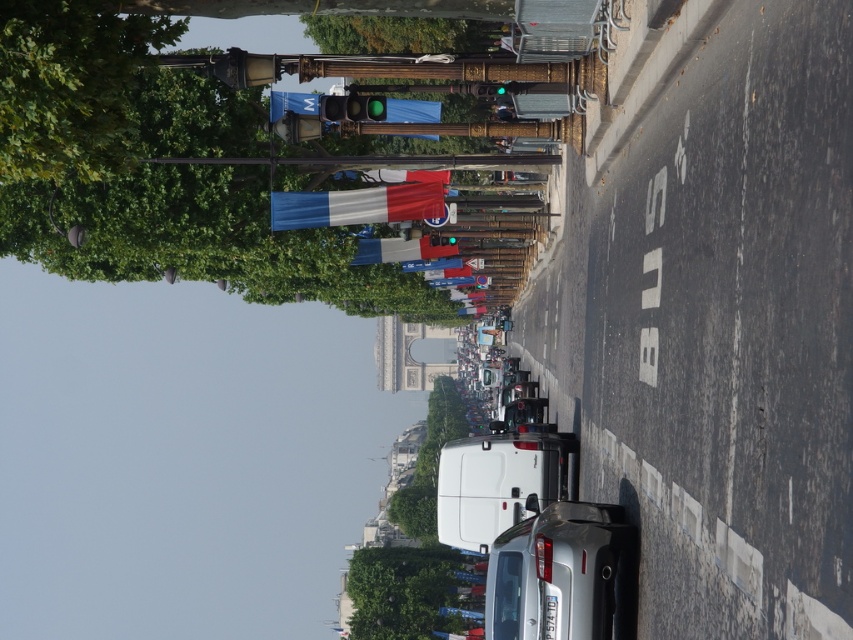
Between tricolor fabric flag at center and green leafy tree at upper center, which one has more height?

With more height is green leafy tree at upper center.

Can you confirm if tricolor fabric flag at center is bigger than green leafy tree at upper center?

Actually, tricolor fabric flag at center might be smaller than green leafy tree at upper center.

This screenshot has width=853, height=640. Describe the element at coordinates (361, 204) in the screenshot. I see `tricolor fabric flag at center` at that location.

Locate an element on the screen. The width and height of the screenshot is (853, 640). tricolor fabric flag at center is located at coordinates (361, 204).

At what (x,y) coordinates should I click in order to perform the action: click on green leafy tree at upper left. Please return your answer as a coordinate pair (x, y). Looking at the image, I should click on [68, 83].

Does green leafy tree at upper left have a larger size compared to tricolor fabric flag at center?

Incorrect, green leafy tree at upper left is not larger than tricolor fabric flag at center.

Is point (51, 81) in front of point (316, 212)?

Yes, it is.

This screenshot has width=853, height=640. Find the location of `green leafy tree at upper left`. green leafy tree at upper left is located at coordinates (68, 83).

Can you confirm if white asphalt road at center is bigger than satin silver car at center?

Yes, white asphalt road at center is bigger than satin silver car at center.

Is white asphalt road at center smaller than satin silver car at center?

No.

At what (x,y) coordinates should I click in order to perform the action: click on white asphalt road at center. Please return your answer as a coordinate pair (x, y). Looking at the image, I should click on (712, 314).